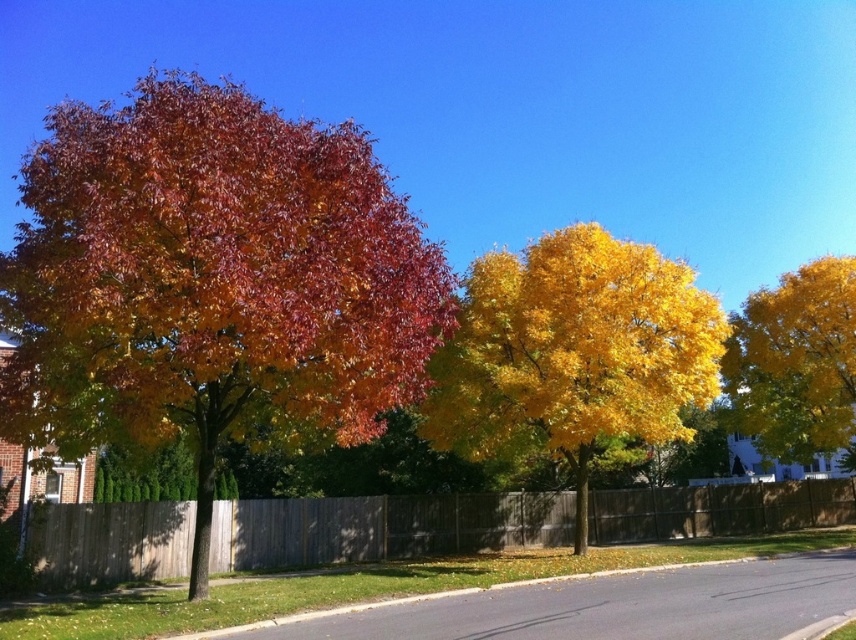
You are a painter planning to sketch this autumn scene. You want to ensure the wooden fence at center and the yellow glossy tree at right are proportionally accurate. Based on their sizes in the image, which one should you draw wider in your painting?

The wooden fence at center should be drawn wider than the yellow glossy tree at right because its width is larger according to the description.

You are a landscape architect assessing the autumn trees in the scene. Which tree has a greater height between the multicolored foliage at left and the golden yellow leaves at center?

The multicolored foliage at left has a greater height compared to the golden yellow leaves at center.

You are a photographer wanting to capture the multicolored foliage at left and the yellow glossy tree at right in a single frame. Based on their positions, which one would appear closer to the camera in the photo?

The multicolored foliage at left would appear closer to the camera because it is positioned in front of the yellow glossy tree at right.